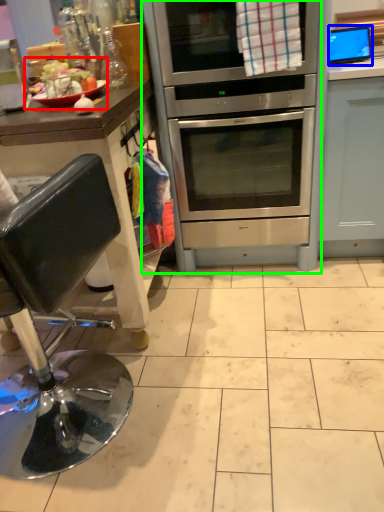
Question: Based on their relative distances, which object is farther from food (highlighted by a red box)? Choose from appliance (highlighted by a blue box) and oven (highlighted by a green box).

Choices:
 (A) appliance
 (B) oven

Answer: (A)